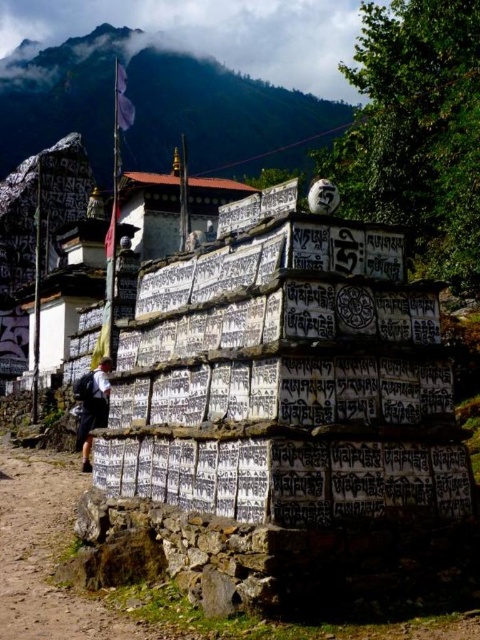
Does white stone prayer wheel at center appear on the left side of green grassy mountain at upper center?

In fact, white stone prayer wheel at center is to the right of green grassy mountain at upper center.

Does white stone prayer wheel at center have a lesser height compared to green grassy mountain at upper center?

Yes, white stone prayer wheel at center is shorter than green grassy mountain at upper center.

Locate an element on the screen. The height and width of the screenshot is (640, 480). white stone prayer wheel at center is located at coordinates (285, 412).

At what (x,y) coordinates should I click in order to perform the action: click on white stone prayer wheel at center. Please return your answer as a coordinate pair (x, y). Looking at the image, I should click on (285, 412).

The image size is (480, 640). What do you see at coordinates (156, 108) in the screenshot?
I see `green grassy mountain at upper center` at bounding box center [156, 108].

Is green grassy mountain at upper center to the left of white fabric backpack at lower left from the viewer's perspective?

Indeed, green grassy mountain at upper center is positioned on the left side of white fabric backpack at lower left.

Which is in front, point (27, 129) or point (109, 371)?

Point (109, 371) is in front.

Locate an element on the screen. green grassy mountain at upper center is located at coordinates (156, 108).

Which is in front, point (307, 269) or point (93, 394)?

Positioned in front is point (307, 269).

Looking at this image, measure the distance between white stone prayer wheel at center and camera.

white stone prayer wheel at center and camera are 29.10 meters apart from each other.

This screenshot has width=480, height=640. What do you see at coordinates (285, 412) in the screenshot?
I see `white stone prayer wheel at center` at bounding box center [285, 412].

Locate an element on the screen. white stone prayer wheel at center is located at coordinates (285, 412).